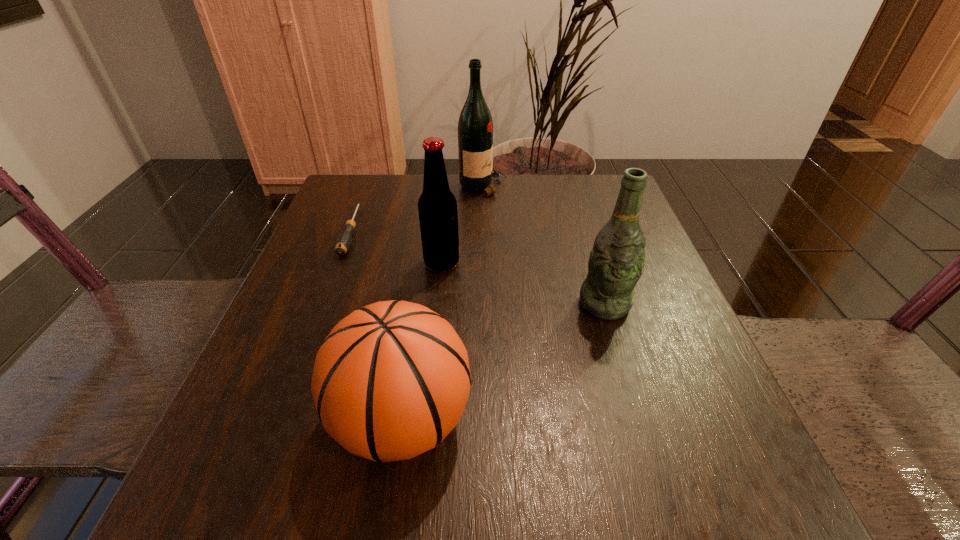
You are a GUI agent. You are given a task and a screenshot of the screen. Output one action in this format:
    pyautogui.click(x=<x>, y=<y>)
    Task: Click on the free space between the right beer bottle and the left beer bottle
    Image resolution: width=960 pixels, height=540 pixels.
    Given the screenshot: What is the action you would take?
    pyautogui.click(x=523, y=284)

The image size is (960, 540). Identify the location of free space that is in between the fourth farthest object and the left beer bottle. (523, 284).

The image size is (960, 540). What are the coordinates of `unoccupied position between the left beer bottle and the second nearest object` in the screenshot? It's located at (523, 284).

You are a GUI agent. You are given a task and a screenshot of the screen. Output one action in this format:
    pyautogui.click(x=<x>, y=<y>)
    Task: Click on the blank region between the nearest object and the right beer bottle
    
    Given the screenshot: What is the action you would take?
    pyautogui.click(x=504, y=362)

The width and height of the screenshot is (960, 540). Identify the location of free space between the left beer bottle and the leftmost object. (396, 247).

The image size is (960, 540). Identify the location of free space between the screwdriver and the left beer bottle. (396, 247).

The image size is (960, 540). Identify the location of object that is the second closest to the farthest object. 344,240.

At what (x,y) coordinates should I click in order to perform the action: click on object that is the closest one to the farthest object. Please return your answer as a coordinate pair (x, y). This screenshot has width=960, height=540. Looking at the image, I should click on click(x=437, y=206).

This screenshot has width=960, height=540. Identify the location of free space that satisfies the following two spatial constraints: 1. on the front side of the farther beer bottle; 2. on the right side of the screwdriver. (340, 263).